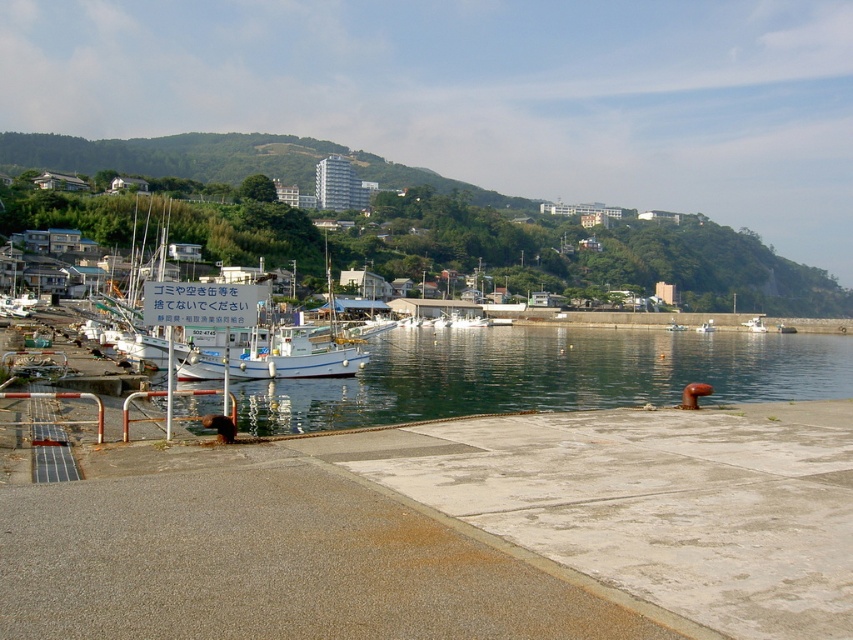
Question: Which of the following is the farthest from the observer?

Choices:
 (A) green grassy hillside at upper center
 (B) clear water at dock center

Answer: (A)

Question: Among these objects, which one is nearest to the camera?

Choices:
 (A) green grassy hillside at upper center
 (B) clear water at dock center

Answer: (B)

Question: Can you confirm if clear water at dock center is thinner than green grassy hillside at upper center?

Choices:
 (A) yes
 (B) no

Answer: (A)

Question: Does clear water at dock center appear over green grassy hillside at upper center?

Choices:
 (A) yes
 (B) no

Answer: (B)

Question: From the image, what is the correct spatial relationship of clear water at dock center in relation to green grassy hillside at upper center?

Choices:
 (A) below
 (B) above

Answer: (A)